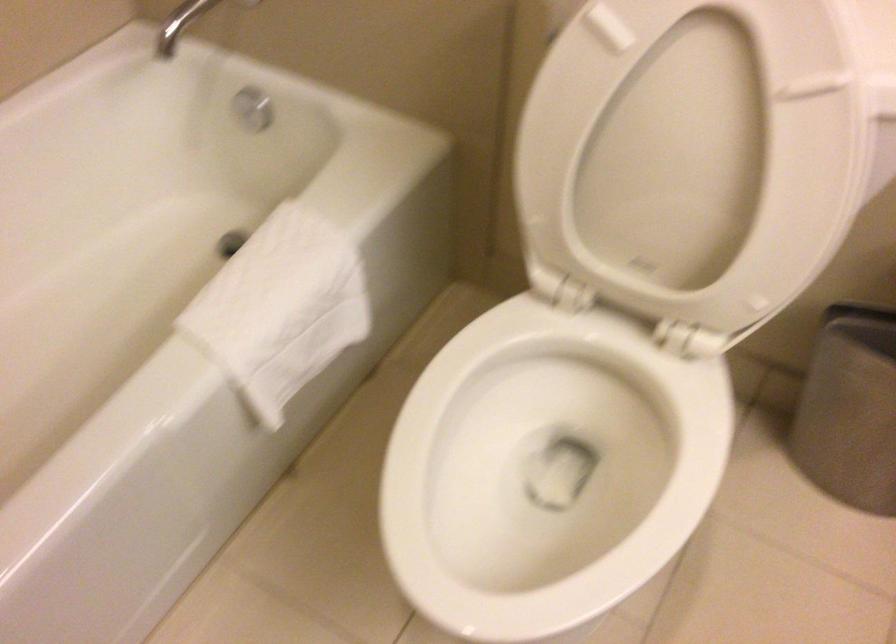
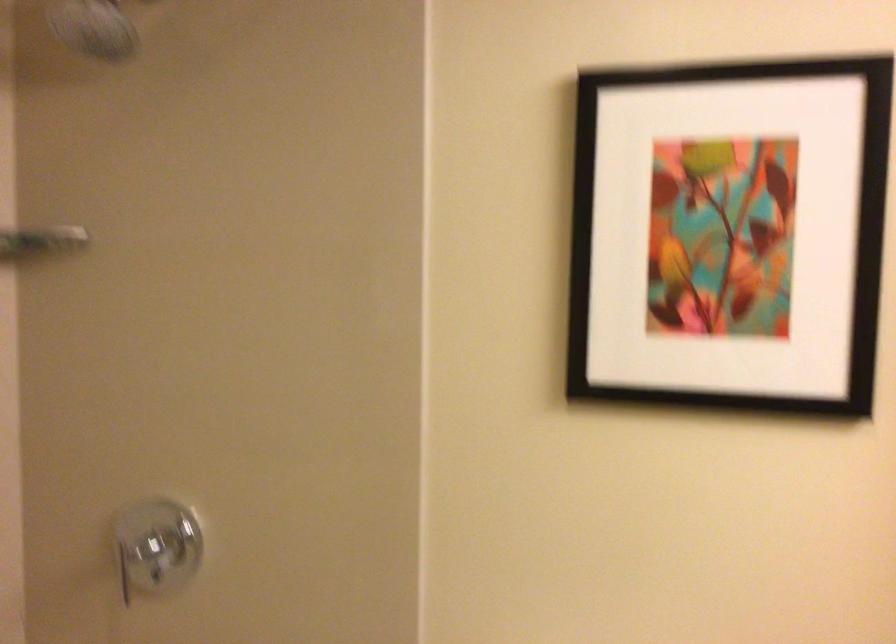
How did the camera likely rotate?

The camera rotated toward right-up.